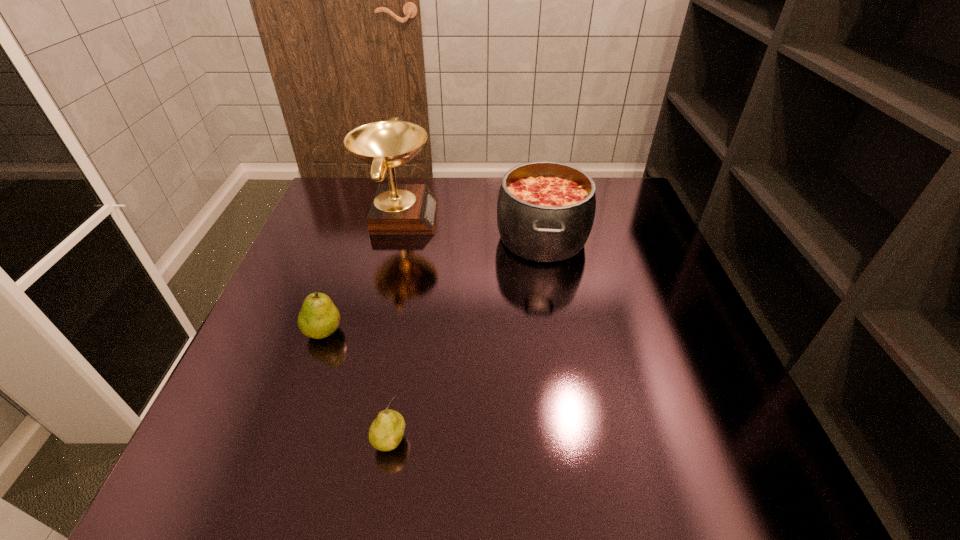
At what (x,y) coordinates should I click in order to perform the action: click on free space between the award and the left pear. Please return your answer as a coordinate pair (x, y). This screenshot has height=540, width=960. Looking at the image, I should click on (361, 273).

This screenshot has width=960, height=540. Find the location of `blank region between the tallest object and the farther pear`. blank region between the tallest object and the farther pear is located at coordinates pos(361,273).

The height and width of the screenshot is (540, 960). Identify the location of vacant area between the second nearest object and the award. (361, 273).

Identify the location of free space between the right pear and the second tallest object. This screenshot has height=540, width=960. (467, 340).

Where is `object that is the second closest to the second tallest object`? object that is the second closest to the second tallest object is located at coordinates (318, 318).

Image resolution: width=960 pixels, height=540 pixels. I want to click on object that stands as the second closest to the shortest object, so click(545, 211).

At what (x,y) coordinates should I click in order to perform the action: click on vacant area in the image that satisfies the following two spatial constraints: 1. on the front-facing side of the third shortest object; 2. on the right side of the award. Please return your answer as a coordinate pair (x, y). Looking at the image, I should click on (394, 238).

Image resolution: width=960 pixels, height=540 pixels. Find the location of `vacant position in the image that satisfies the following two spatial constraints: 1. on the front-facing side of the award; 2. on the right side of the nearer pear`. vacant position in the image that satisfies the following two spatial constraints: 1. on the front-facing side of the award; 2. on the right side of the nearer pear is located at coordinates point(345,441).

This screenshot has width=960, height=540. In order to click on vacant space that satisfies the following two spatial constraints: 1. on the front-facing side of the tallest object; 2. on the back side of the nearest object in this screenshot , I will do `click(345, 441)`.

You are a GUI agent. You are given a task and a screenshot of the screen. Output one action in this format:
    pyautogui.click(x=<x>, y=<y>)
    Task: Click on the vacant space that satisfies the following two spatial constraints: 1. on the back side of the rightmost object; 2. on the front-facing side of the award
    The image size is (960, 540).
    Given the screenshot: What is the action you would take?
    pyautogui.click(x=539, y=215)